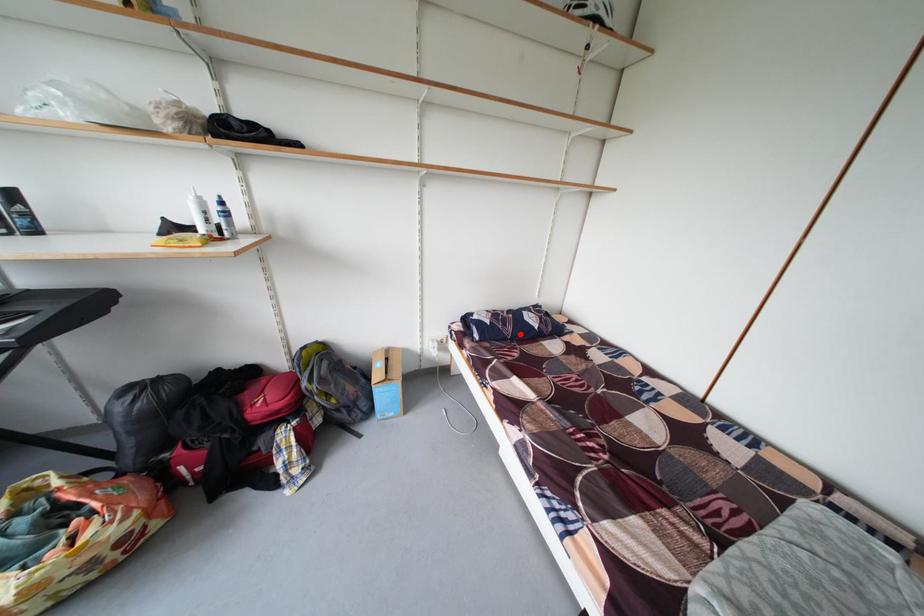
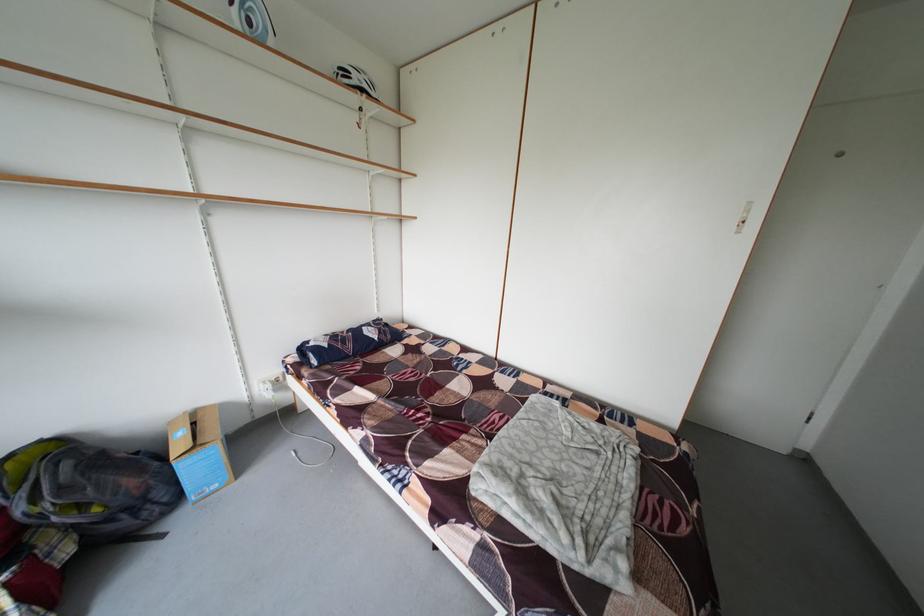
Find the pixel in the second image that matches the highlighted location in the first image.

(360, 351)